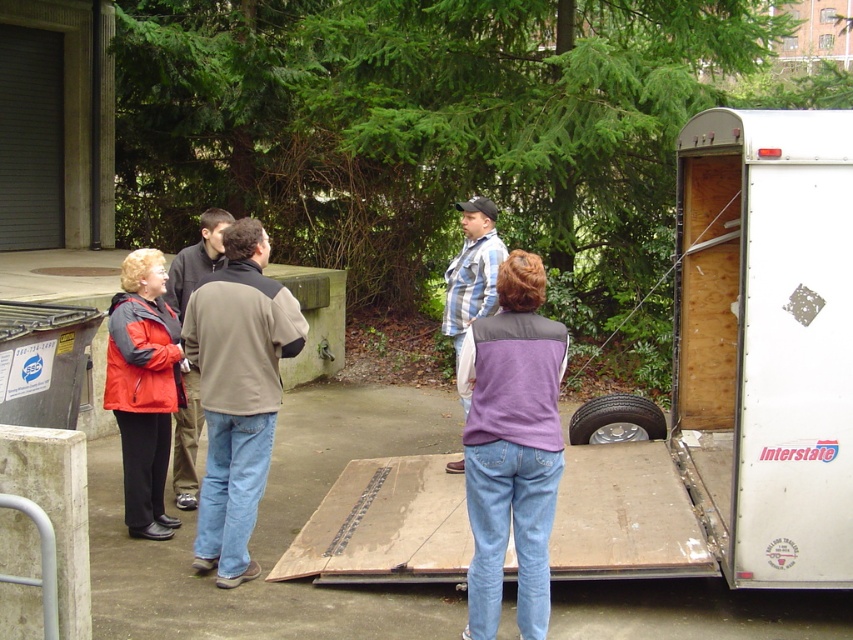
Question: Which point is closer to the camera?

Choices:
 (A) pos(577,440)
 (B) pos(228,316)
 (C) pos(181,417)
 (D) pos(474,230)

Answer: (B)

Question: Which point is farther to the camera?

Choices:
 (A) (463, 314)
 (B) (212, 259)
 (C) (216, 413)

Answer: (A)

Question: Is brown fleece jacket at center below black rubber tire at lower right?

Choices:
 (A) no
 (B) yes

Answer: (A)

Question: Among these points, which one is farthest from the camera?

Choices:
 (A) (218, 212)
 (B) (630, 408)
 (C) (451, 333)

Answer: (B)

Question: Is brown fleece jacket at center above black rubber tire at lower right?

Choices:
 (A) yes
 (B) no

Answer: (A)

Question: Is brown leather jacket at center positioned before blue striped shirt at center?

Choices:
 (A) yes
 (B) no

Answer: (A)